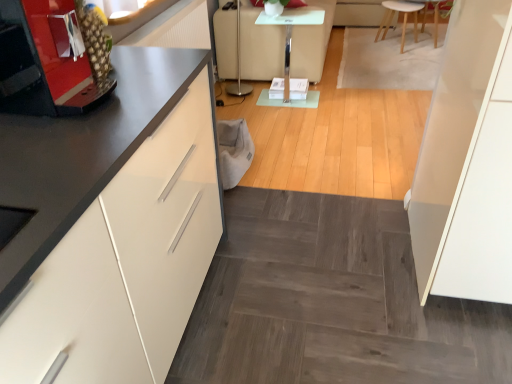
Find the location of `free point in front of light wood stool at upper right`. free point in front of light wood stool at upper right is located at coordinates (400, 64).